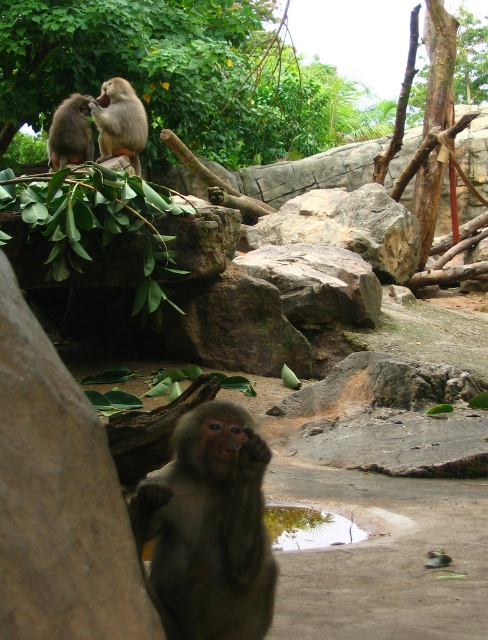
You are a zookeeper planning to install a new feeding station. You need to choose between placing it near the green leafy tree at upper left or the rocky gray rock at center. Which location offers more vertical space for the structure?

The green leafy tree at upper left offers more vertical space because it is much taller than the rocky gray rock at center, providing a higher elevation for the feeding station.

You are a zookeeper planning to place a feeding station between the green leafy tree at upper left and the gray furry monkey at upper left. Which object should the feeding station be closer to if it needs to be wider than the monkey but narrower than the tree?

The feeding station should be closer to the gray furry monkey at upper left because the green leafy tree at upper left is wider than the monkey, so placing it closer to the monkey ensures it is wider than the monkey but narrower than the tree.